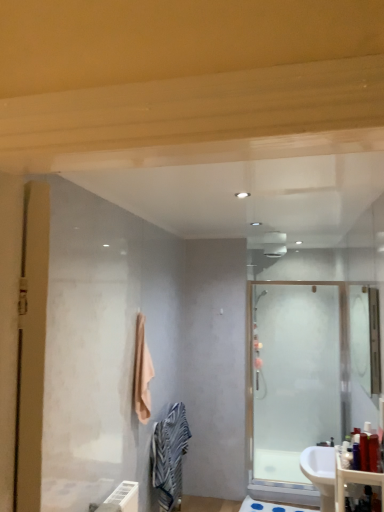
Question: Is frosted glass shower door at right oriented towards translucent plastic bottle at lower right, the first toiletry viewed from the right?

Choices:
 (A) yes
 (B) no

Answer: (A)

Question: Considering the relative sizes of frosted glass shower door at right and translucent plastic bottle at lower right, the first toiletry viewed from the right, in the image provided, is frosted glass shower door at right bigger than translucent plastic bottle at lower right, the first toiletry viewed from the right,?

Choices:
 (A) no
 (B) yes

Answer: (B)

Question: From a real-world perspective, is frosted glass shower door at right physically above translucent plastic bottle at lower right, the fourth toiletry from the left?

Choices:
 (A) yes
 (B) no

Answer: (B)

Question: Considering the relative sizes of frosted glass shower door at right and translucent plastic bottle at lower right, the first toiletry viewed from the right, in the image provided, is frosted glass shower door at right wider than translucent plastic bottle at lower right, the first toiletry viewed from the right,?

Choices:
 (A) no
 (B) yes

Answer: (B)

Question: From the image's perspective, is frosted glass shower door at right beneath translucent plastic bottle at lower right, the fourth toiletry from the left?

Choices:
 (A) yes
 (B) no

Answer: (A)

Question: Is the depth of frosted glass shower door at right less than that of translucent plastic bottle at lower right, the first toiletry viewed from the right?

Choices:
 (A) yes
 (B) no

Answer: (B)

Question: Is translucent plastic bottle at right, which ranks as the 2th toiletry in right-to-left order, not close to translucent plastic bottle at lower right, the fourth toiletry from the left?

Choices:
 (A) yes
 (B) no

Answer: (B)

Question: Is translucent plastic bottle at right, the third toiletry viewed from the left, smaller than translucent plastic bottle at lower right, the fourth toiletry from the left?

Choices:
 (A) no
 (B) yes

Answer: (A)

Question: From the image's perspective, is translucent plastic bottle at right, the third toiletry viewed from the left, on top of translucent plastic bottle at lower right, the fourth toiletry from the left?

Choices:
 (A) no
 (B) yes

Answer: (A)

Question: Considering the relative sizes of translucent plastic bottle at right, which ranks as the 2th toiletry in right-to-left order, and translucent plastic bottle at lower right, the first toiletry viewed from the right, in the image provided, is translucent plastic bottle at right, which ranks as the 2th toiletry in right-to-left order, bigger than translucent plastic bottle at lower right, the first toiletry viewed from the right,?

Choices:
 (A) yes
 (B) no

Answer: (A)

Question: From a real-world perspective, is translucent plastic bottle at right, the third toiletry viewed from the left, physically above translucent plastic bottle at lower right, the fourth toiletry from the left?

Choices:
 (A) no
 (B) yes

Answer: (A)

Question: Does translucent plastic bottle at right, the third toiletry viewed from the left, turn towards translucent plastic bottle at lower right, the fourth toiletry from the left?

Choices:
 (A) no
 (B) yes

Answer: (B)

Question: Is translucent plastic bottle at lower right, the fourth toiletry from the left, completely or partially inside matte plastic counter top at lower right?

Choices:
 (A) yes
 (B) no

Answer: (B)